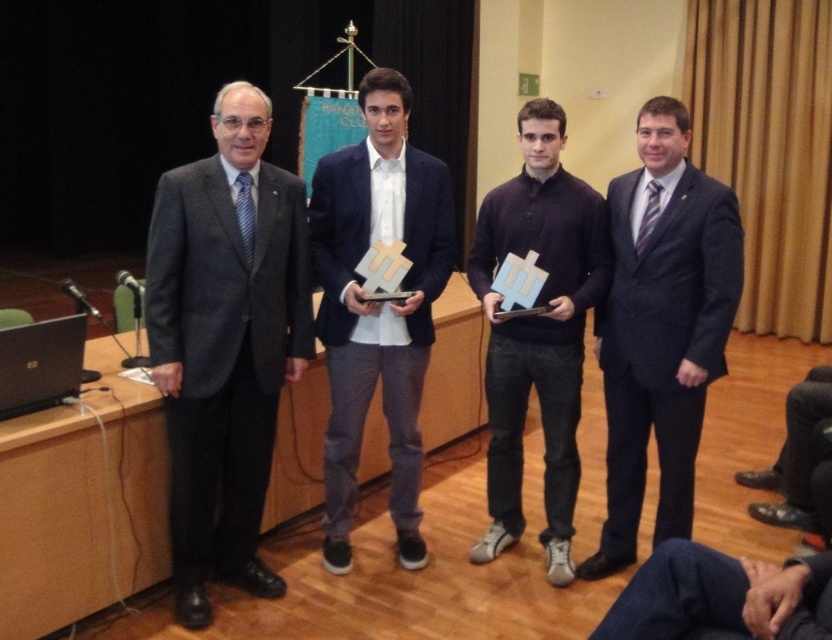
Question: Can you confirm if navy blue suit at center is wider than silver metallic laptop at left?

Choices:
 (A) no
 (B) yes

Answer: (B)

Question: Which object is positioned farthest from the dark blue sweater at center?

Choices:
 (A) dark blue suit at center
 (B) silver metallic laptop at left
 (C) gray wool suit at left

Answer: (B)

Question: Which is farther from the dark blue suit at center?

Choices:
 (A) dark blue sweater at center
 (B) silver metallic laptop at left
 (C) navy blue suit at center
 (D) gray wool suit at left

Answer: (B)

Question: Estimate the real-world distances between objects in this image. Which object is closer to the dark blue sweater at center?

Choices:
 (A) dark blue suit at center
 (B) gray wool suit at left
 (C) blue denim pants at lower right
 (D) navy blue suit at center

Answer: (A)

Question: Is the position of dark blue suit at center more distant than that of blue denim pants at lower right?

Choices:
 (A) no
 (B) yes

Answer: (B)

Question: Is gray wool suit at left smaller than navy blue suit at center?

Choices:
 (A) yes
 (B) no

Answer: (A)